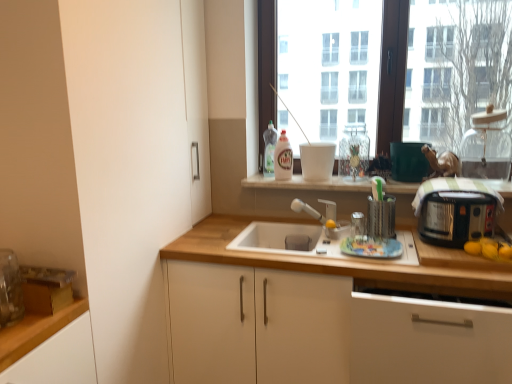
Where is `vacant space in white matte bowl at upper center, placed as the first appliance when sorted from left to right (from a real-world perspective)`? vacant space in white matte bowl at upper center, placed as the first appliance when sorted from left to right (from a real-world perspective) is located at coordinates (315, 180).